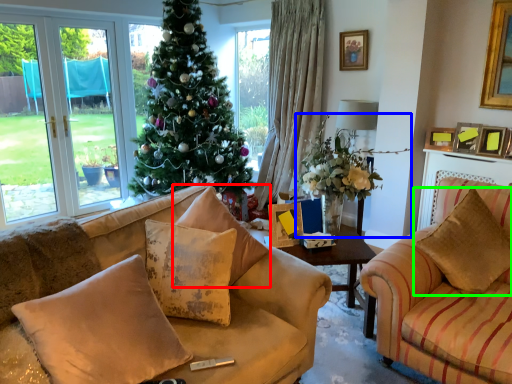
Question: Which object is positioned farthest from pillow (highlighted by a red box)? Select from houseplant (highlighted by a blue box) and pillow (highlighted by a green box).

Choices:
 (A) houseplant
 (B) pillow

Answer: (B)